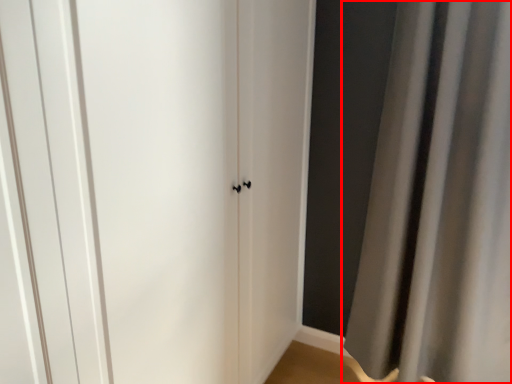
Question: From the image's perspective, what is the correct spatial positioning of curtain (annotated by the red box) in reference to door?

Choices:
 (A) above
 (B) below

Answer: (A)